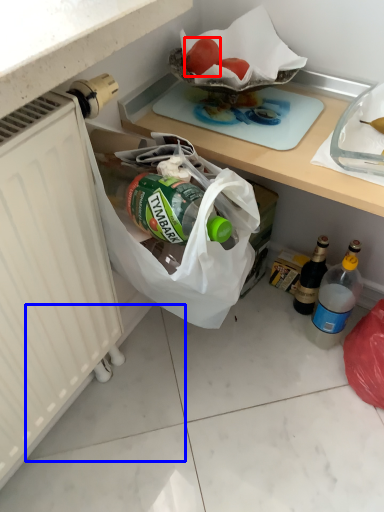
Question: Which point is closer to the camera, fruit (highlighted by a red box) or tile (highlighted by a blue box)?

Choices:
 (A) fruit
 (B) tile

Answer: (A)